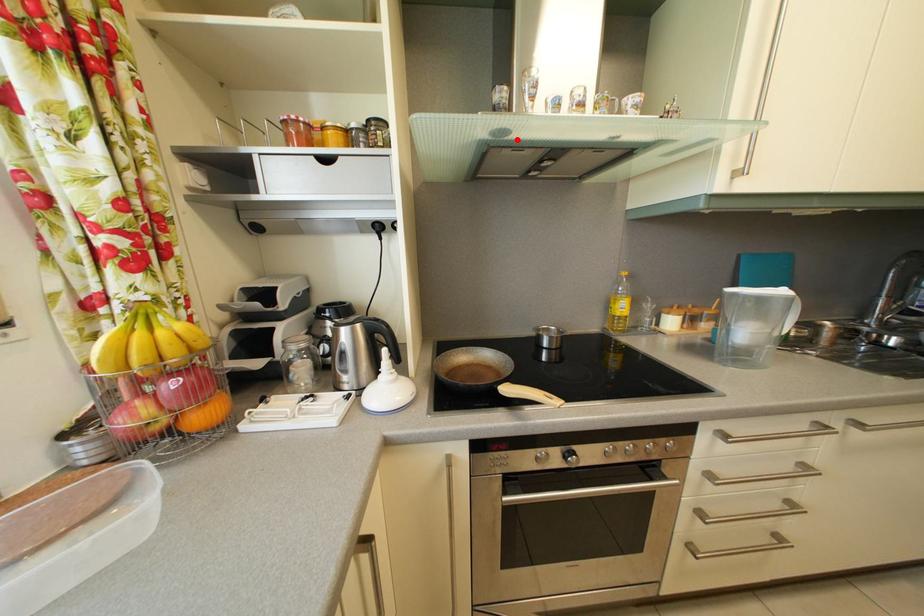
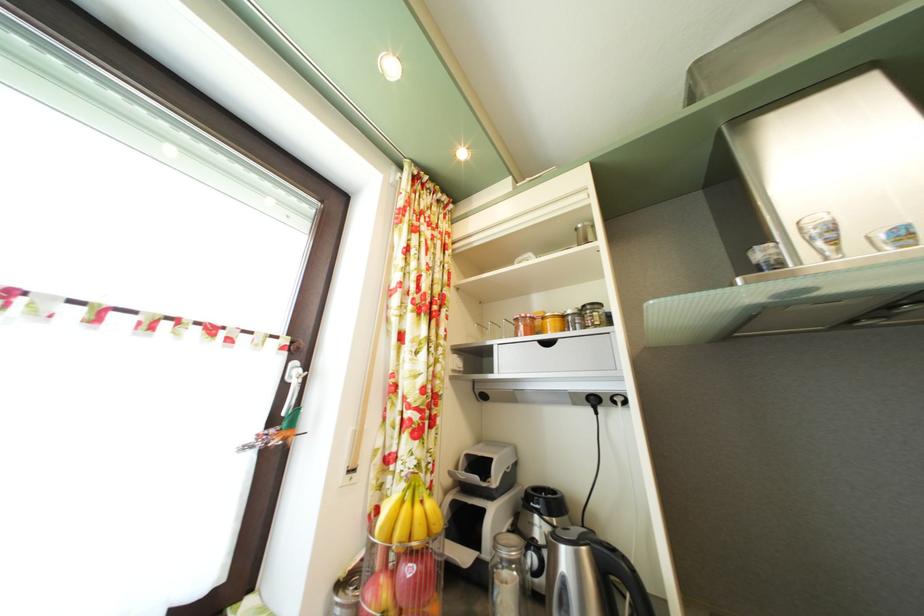
Locate, in the second image, the point that corresponds to the highlighted location in the first image.

(821, 297)